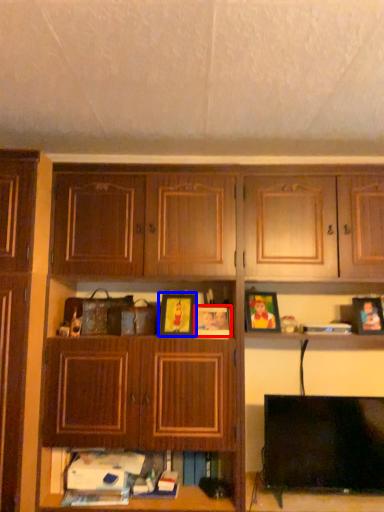
Question: Which object appears closest to the camera in this image, picture frame (highlighted by a red box) or picture frame (highlighted by a blue box)?

Choices:
 (A) picture frame
 (B) picture frame

Answer: (B)